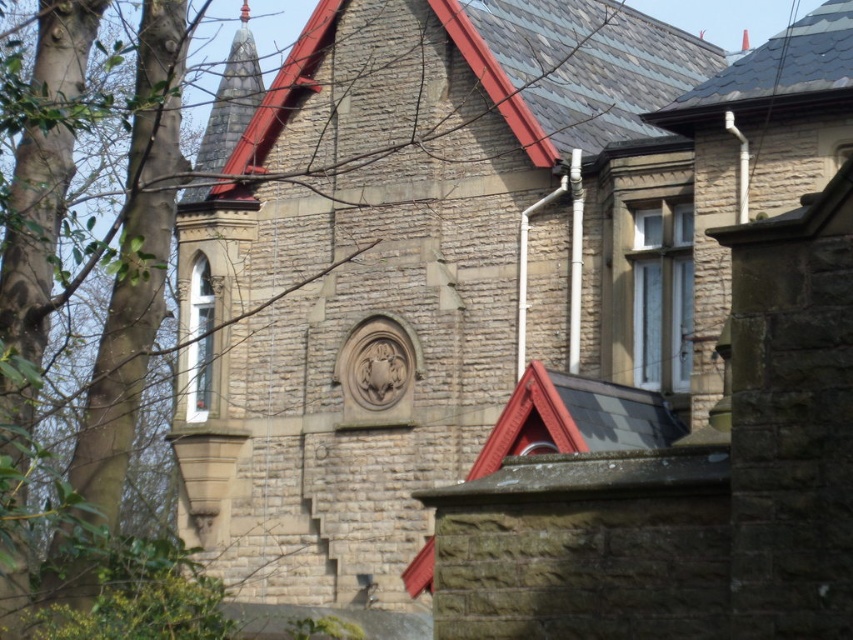
Locate an element on the screen. gray slate roof at upper center is located at coordinates (483, 74).

Between point (624, 67) and point (741, 106), which one is positioned behind?

Point (624, 67)

Is point (553, 93) farther from camera compared to point (804, 93)?

Yes, point (553, 93) is farther from viewer.

At what (x,y) coordinates should I click in order to perform the action: click on gray slate roof at upper center. Please return your answer as a coordinate pair (x, y). The width and height of the screenshot is (853, 640). Looking at the image, I should click on (483, 74).